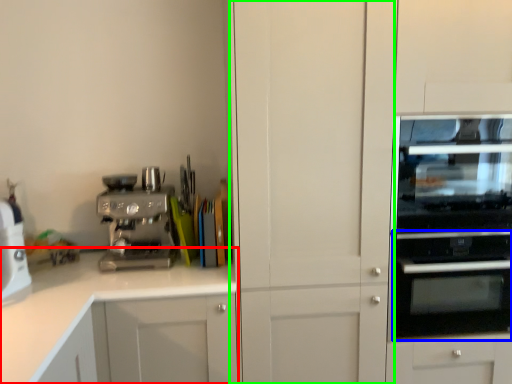
Question: Considering the real-world distances, which object is farthest from cabinetry (highlighted by a red box)? oven (highlighted by a blue box) or glass door (highlighted by a green box)?

Choices:
 (A) oven
 (B) glass door

Answer: (A)